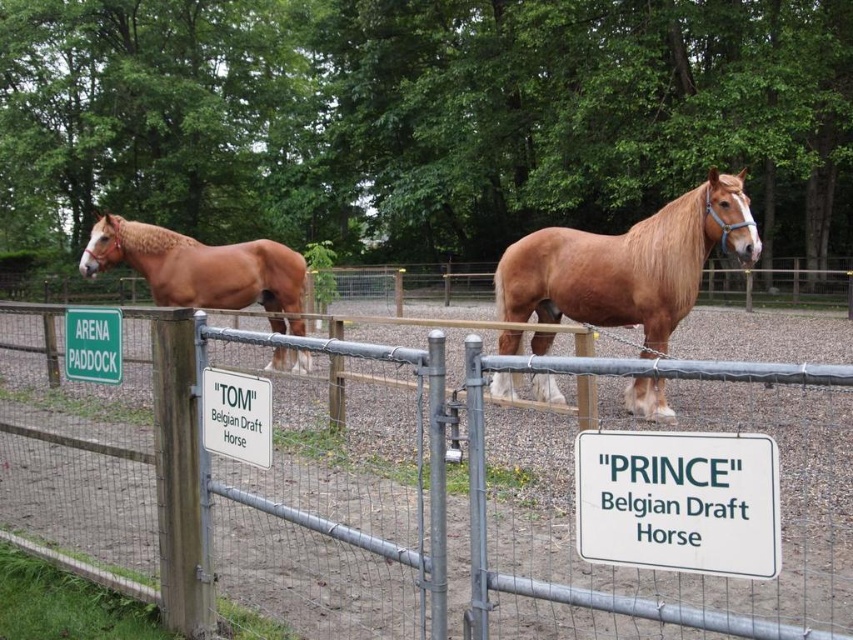
You are standing in front of the arena paddock where the two Belgian Draft Horses are located. You want to take a photo of the exact point at coordinate point (190, 300). What is the minimum focal length you need to use to capture that point in focus?

To capture the point at coordinate point (190, 300) which is 12.30 meters away, you need to use a focal length of at least 12.30 meters to ensure it is in focus.

You are standing in front of the arena paddock fence. There are two points marked on the ground at point coordinates point (752, 522) and point (210, 397). Which point is closer to you?

Point (752, 522) is closer to the viewer than point (210, 397).